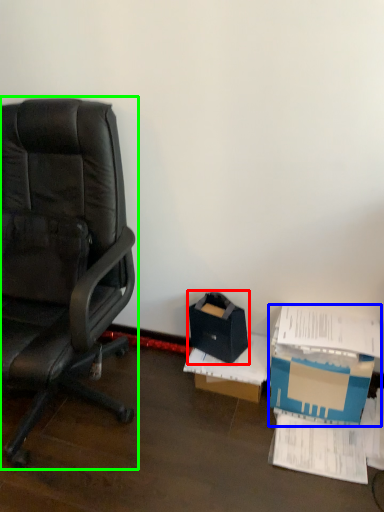
Question: Based on their relative distances, which object is farther from storage box (highlighted by a red box)? Choose from box (highlighted by a blue box) and chair (highlighted by a green box).

Choices:
 (A) box
 (B) chair

Answer: (B)